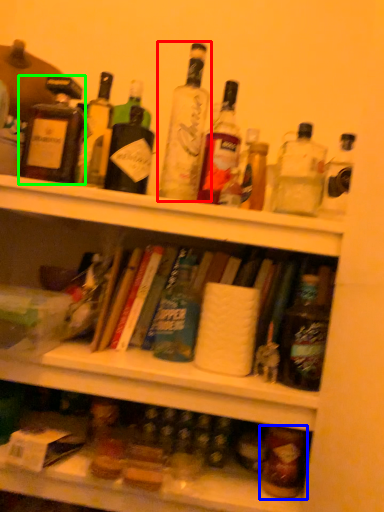
Question: Estimate the real-world distances between objects in this image. Which object is farther from bottle (highlighted by a red box), bottle (highlighted by a blue box) or bottle (highlighted by a green box)?

Choices:
 (A) bottle
 (B) bottle

Answer: (A)